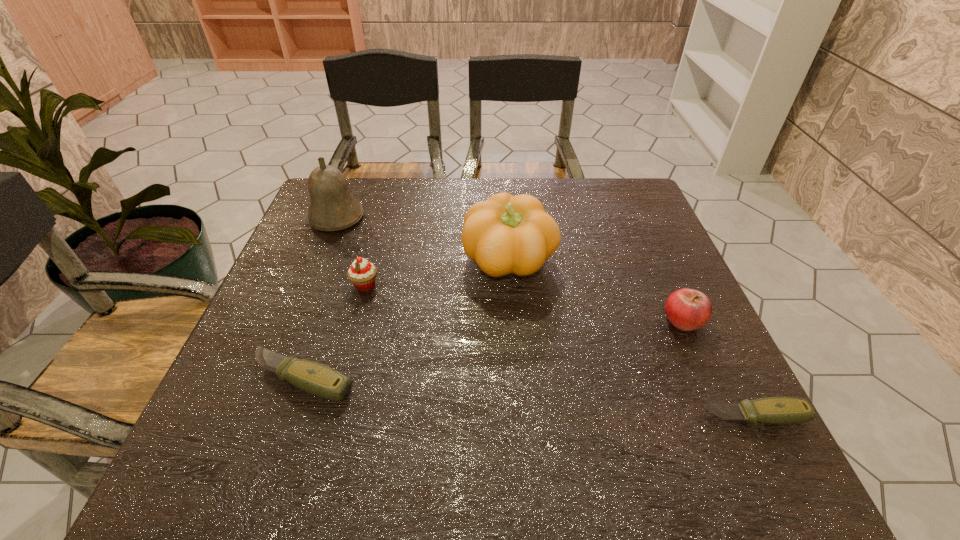
If equal spacing is desired by inserting an extra pocketknife among them, please point out a free spot for this new pocketknife. Please provide its 2D coordinates. Your answer should be formatted as a tuple, i.e. [(x, y)], where the tuple contains the x and y coordinates of a point satisfying the conditions above.

[(520, 396)]